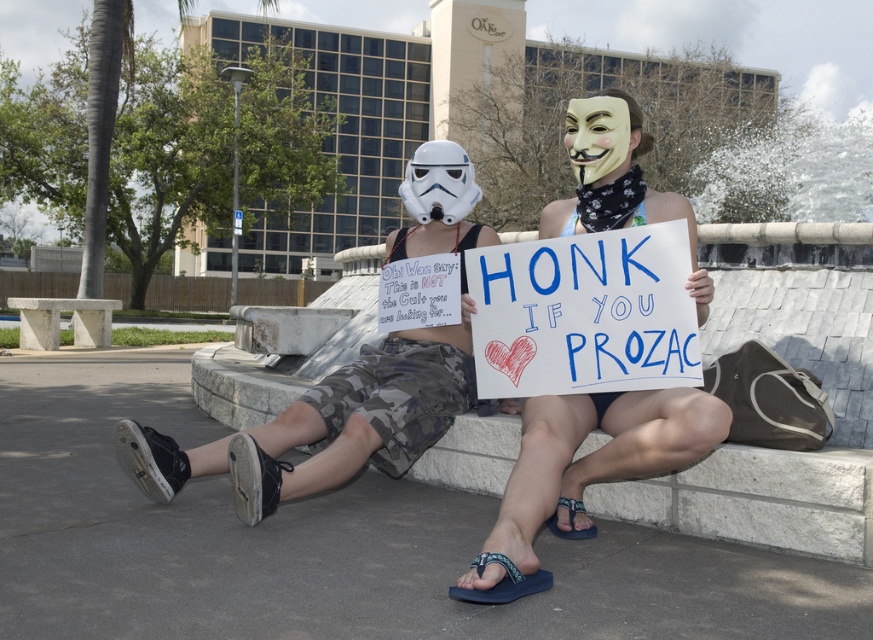
Is point (333, 467) less distant than point (541, 584)?

That is False.

Does matte white helmet at center have a smaller size compared to white cardboard sign at center?

Incorrect, matte white helmet at center is not smaller in size than white cardboard sign at center.

Who is more distant from viewer, (314, 474) or (684, 444)?

Positioned behind is point (314, 474).

The image size is (873, 640). I want to click on matte white helmet at center, so click(x=325, y=426).

Does camouflage shorts at center have a smaller size compared to matte white helmet at center?

Yes, camouflage shorts at center is smaller than matte white helmet at center.

Which is more to the right, camouflage shorts at center or matte white helmet at center?

matte white helmet at center

Is point (533, 577) positioned in front of point (238, 483)?

Yes, point (533, 577) is closer to viewer.

The height and width of the screenshot is (640, 873). In order to click on camouflage shorts at center in this screenshot , I will do `click(583, 470)`.

Does camouflage shorts at center have a lesser height compared to white cardboard sign at center?

In fact, camouflage shorts at center may be taller than white cardboard sign at center.

Is camouflage shorts at center to the right of white cardboard sign at center from the viewer's perspective?

No, camouflage shorts at center is not to the right of white cardboard sign at center.

Between point (554, 528) and point (660, 436), which one is positioned behind?

Point (554, 528)

Locate an element on the screen. camouflage shorts at center is located at coordinates (583, 470).